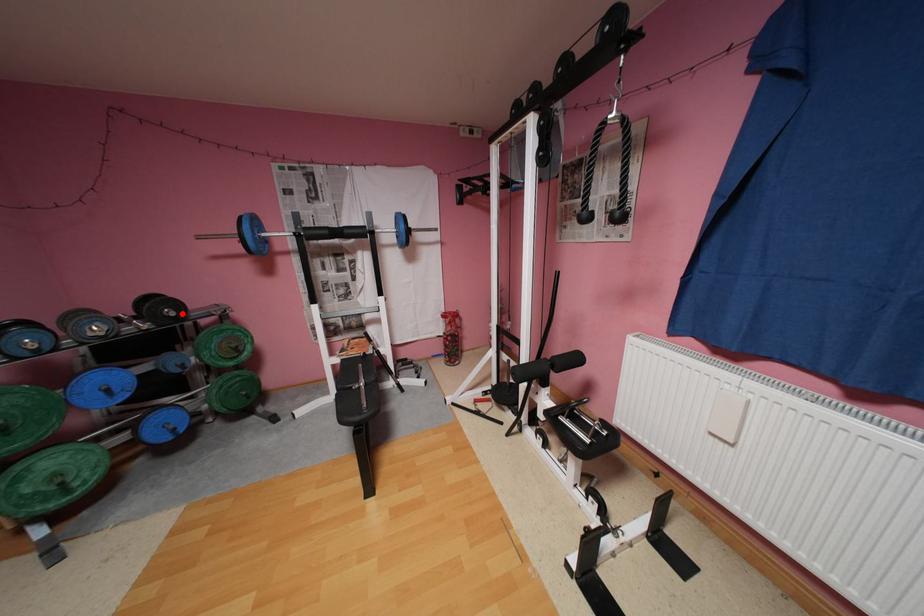
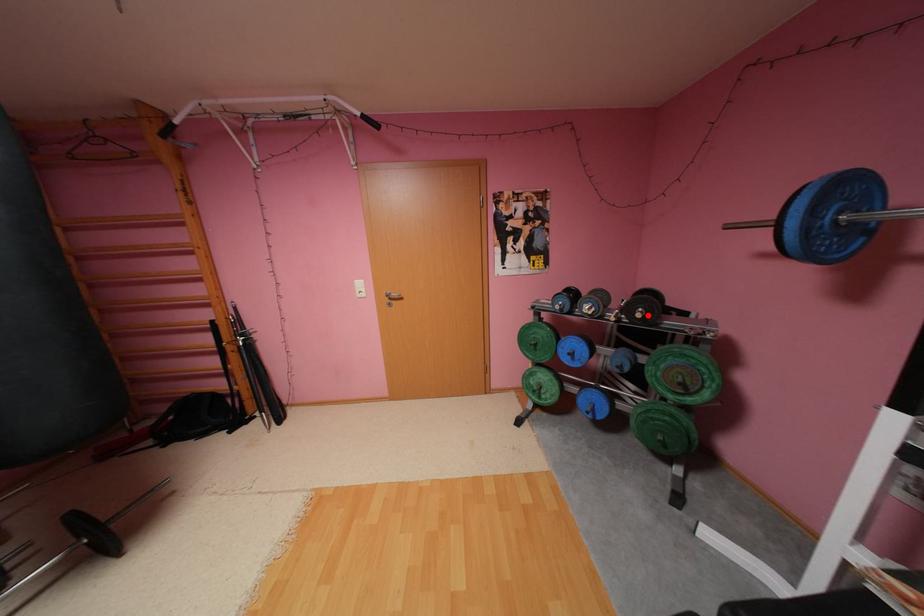
I am providing you with two images of the same scene from different viewpoints. A red point is marked on the first image and another point is marked on the second image. Do the highlighted points in image1 and image2 indicate the same real-world spot?

Yes